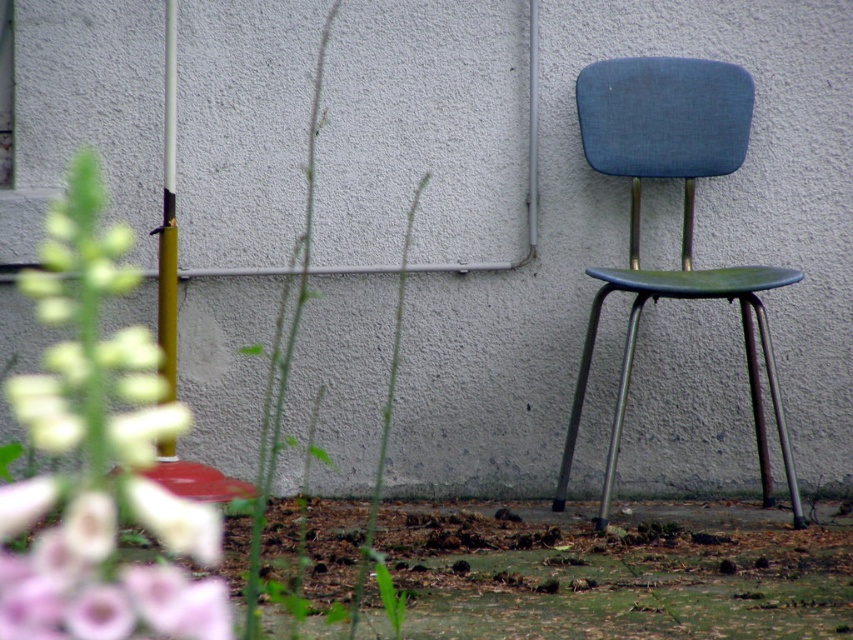
You are standing in the garden and see the blue fabric chair at right and the green leafy stem at center. Which object is closer to the right side of the garden?

The blue fabric chair at right is closer to the right side of the garden than the green leafy stem at center.

You are standing in the garden and want to place a small potted plant between the white fuzzy flowers at lower left and the blue fabric chair at right. Which direction should you move from the flowers to reach the chair?

You should move to the right from the white fuzzy flowers at lower left to reach the blue fabric chair at right because the flowers are positioned to the left of the chair.

You are planning to place a new decorative item between the white fuzzy flowers at lower left and the blue fabric chair at right. Considering their widths, which object should you position closer to the center of the scene to ensure the decorative item fits properly?

The white fuzzy flowers at lower left are wider than the blue fabric chair at right. To ensure the decorative item fits properly, position it closer to the blue fabric chair at right since the flowers are wider and occupy more space on the left side.